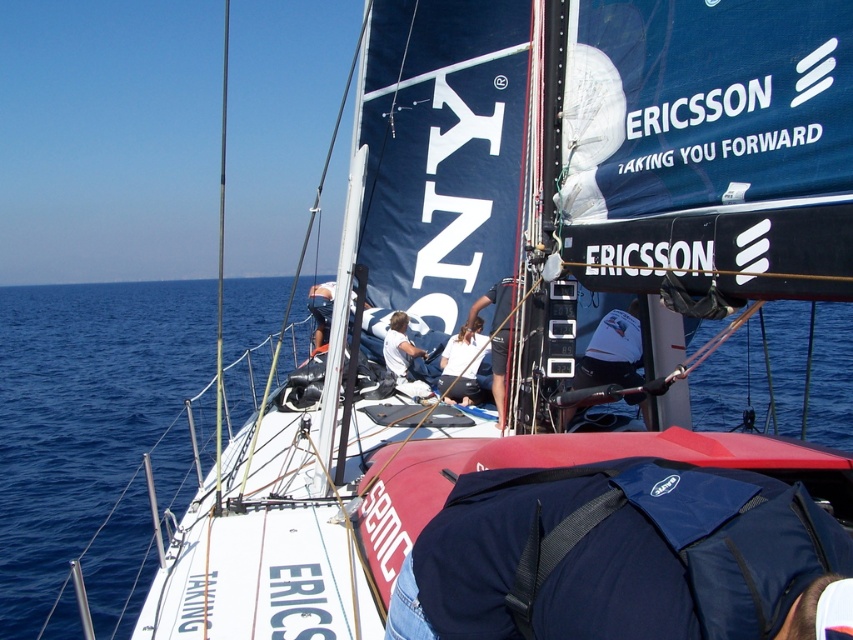
Question: Does blue fabric bag at center have a larger size compared to white fabric shirt at center?

Choices:
 (A) yes
 (B) no

Answer: (A)

Question: Which point is farther from the camera taking this photo?

Choices:
 (A) tap(476, 332)
 (B) tap(395, 326)

Answer: (B)

Question: Which point is farther from the camera taking this photo?

Choices:
 (A) (457, 364)
 (B) (387, 339)

Answer: (B)

Question: Which is farther from the blue fabric bag at center?

Choices:
 (A) white fabric shirt at center
 (B) white fabric at center

Answer: (A)

Question: Is blue fabric bag at center thinner than white fabric shirt at center?

Choices:
 (A) no
 (B) yes

Answer: (A)

Question: Is white fabric at center below white fabric shirt at center?

Choices:
 (A) yes
 (B) no

Answer: (B)